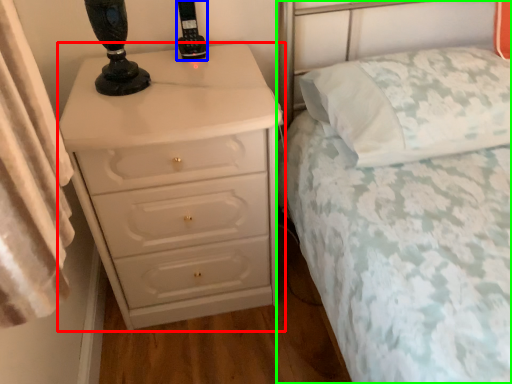
Question: Which is farther away from chest of drawers (highlighted by a red box)? control (highlighted by a blue box) or bed (highlighted by a green box)?

Choices:
 (A) control
 (B) bed

Answer: (A)